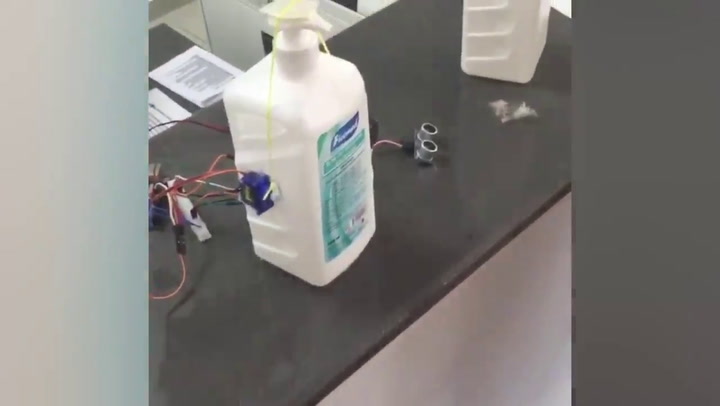
Find the location of a particular element. This screenshot has height=406, width=720. front of the counter is located at coordinates (487, 349).